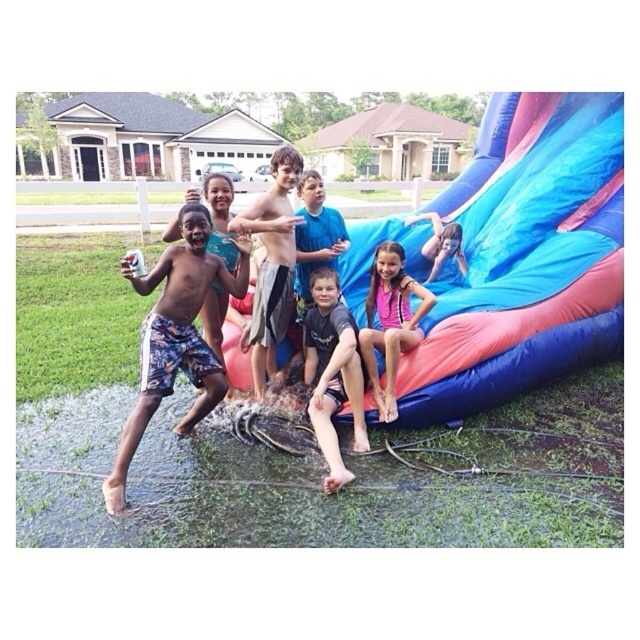
You are a photographer trying to capture the child in the shiny metallic shorts at center without the pink fabric at center showing in the background. Can you adjust your angle to achieve this?

The shiny metallic shorts at center is positioned over pink fabric at center, so adjusting the angle might not hide the pink fabric at center since they are layered. The photographer should consider repositioning the child or the fabric instead.